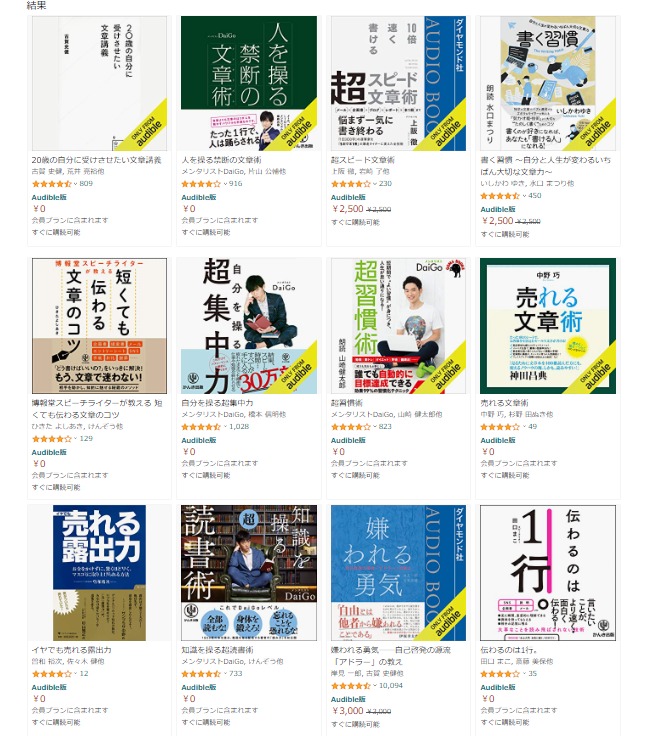
You are a GUI agent. You are given a task and a screenshot of the screen. Output one action in this format:
    pyautogui.click(x=<x>, y=<y>)
    Task: Click on the book
    
    Given the screenshot: What is the action you would take?
    pyautogui.click(x=221, y=523)